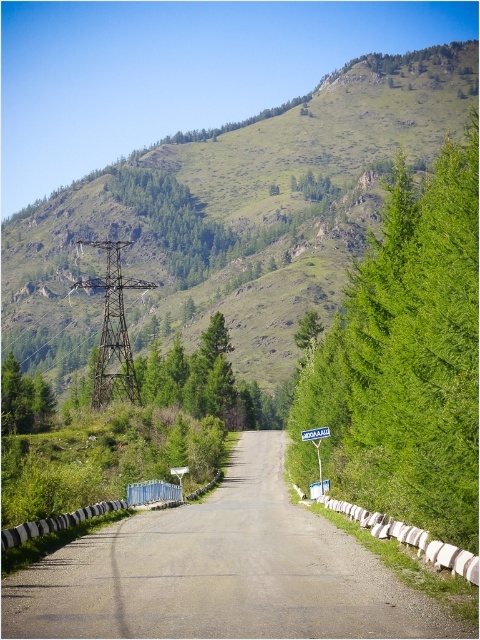
Question: Is green grassy mountain at upper center smaller than green matte tree at left?

Choices:
 (A) yes
 (B) no

Answer: (B)

Question: Which point appears closest to the camera in this image?

Choices:
 (A) (242, 433)
 (B) (313, 444)

Answer: (B)

Question: Which of the following is the farthest from the observer?

Choices:
 (A) (251, 186)
 (B) (326, 436)
 (C) (362, 580)

Answer: (A)

Question: Among these objects, which one is nearest to the camera?

Choices:
 (A) green matte tree at left
 (B) green plastic sign at center
 (C) gray asphalt road at center

Answer: (C)

Question: Can you confirm if green grassy mountain at upper center is positioned below green plastic sign at center?

Choices:
 (A) no
 (B) yes

Answer: (A)

Question: Is green leafy tree at right below green plastic sign at center?

Choices:
 (A) yes
 (B) no

Answer: (B)